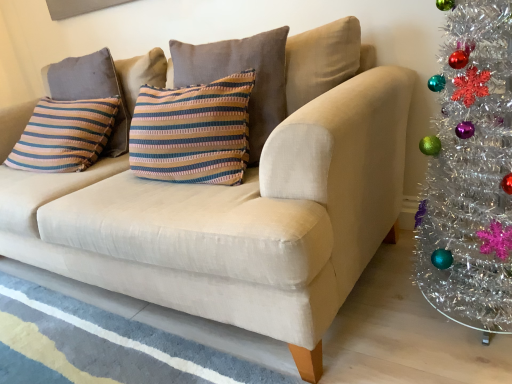
Describe the element at coordinates (240, 71) in the screenshot. The height and width of the screenshot is (384, 512). I see `striped fabric pillow at center, the first pillow from the front` at that location.

Where is `striped fabric pillow at center, the first pillow from the front`? The width and height of the screenshot is (512, 384). striped fabric pillow at center, the first pillow from the front is located at coordinates (240, 71).

Locate an element on the screen. striped fabric pillow at upper left, marked as the 1th pillow in a left-to-right arrangement is located at coordinates (91, 90).

What is the approximate height of striped fabric pillow at upper left, the second pillow positioned from the front?

striped fabric pillow at upper left, the second pillow positioned from the front, is 17.10 inches tall.

Image resolution: width=512 pixels, height=384 pixels. Describe the element at coordinates (91, 90) in the screenshot. I see `striped fabric pillow at upper left, the 2th pillow positioned from the right` at that location.

The width and height of the screenshot is (512, 384). Find the location of `striped fabric pillow at center, the 2th pillow in the left-to-right sequence`. striped fabric pillow at center, the 2th pillow in the left-to-right sequence is located at coordinates (240, 71).

Considering the relative positions of striped fabric pillow at upper left, marked as the 1th pillow in a left-to-right arrangement, and striped fabric pillow at center, the first pillow from the front, in the image provided, is striped fabric pillow at upper left, marked as the 1th pillow in a left-to-right arrangement, to the left or to the right of striped fabric pillow at center, the first pillow from the front,?

From the image, it's evident that striped fabric pillow at upper left, marked as the 1th pillow in a left-to-right arrangement, is to the left of striped fabric pillow at center, the first pillow from the front.

Considering the positions of objects striped fabric pillow at upper left, the 1th pillow viewed from the back, and striped fabric pillow at center, the 2th pillow viewed from the back, in the image provided, who is behind, striped fabric pillow at upper left, the 1th pillow viewed from the back, or striped fabric pillow at center, the 2th pillow viewed from the back,?

striped fabric pillow at upper left, the 1th pillow viewed from the back, is more distant.

Considering the points (108, 57) and (264, 92), which point is in front, point (108, 57) or point (264, 92)?

The point (264, 92) is more forward.

From the image's perspective, between striped fabric pillow at upper left, the 2th pillow positioned from the right, and striped fabric pillow at center, the 2th pillow in the left-to-right sequence, which one is located above?

striped fabric pillow at upper left, the 2th pillow positioned from the right, is shown above in the image.

From a real-world perspective, is striped fabric pillow at upper left, marked as the 1th pillow in a left-to-right arrangement, positioned over striped fabric pillow at center, which appears as the first pillow when viewed from the right, based on gravity?

Incorrect, from a real-world perspective, striped fabric pillow at upper left, marked as the 1th pillow in a left-to-right arrangement, is lower than striped fabric pillow at center, which appears as the first pillow when viewed from the right.

Can you confirm if striped fabric pillow at upper left, marked as the 1th pillow in a left-to-right arrangement, is wider than striped fabric pillow at center, which appears as the first pillow when viewed from the right?

No, striped fabric pillow at upper left, marked as the 1th pillow in a left-to-right arrangement, is not wider than striped fabric pillow at center, which appears as the first pillow when viewed from the right.

Can you confirm if striped fabric pillow at upper left, the 2th pillow positioned from the right, is shorter than striped fabric pillow at center, the first pillow from the front?

Correct, striped fabric pillow at upper left, the 2th pillow positioned from the right, is not as tall as striped fabric pillow at center, the first pillow from the front.

Considering the sizes of objects striped fabric pillow at upper left, the 2th pillow positioned from the right, and striped fabric pillow at center, the 2th pillow viewed from the back, in the image provided, who is bigger, striped fabric pillow at upper left, the 2th pillow positioned from the right, or striped fabric pillow at center, the 2th pillow viewed from the back,?

Bigger between the two is striped fabric pillow at center, the 2th pillow viewed from the back.

Is striped fabric pillow at upper left, marked as the 1th pillow in a left-to-right arrangement, located outside striped fabric pillow at center, the first pillow from the front?

striped fabric pillow at upper left, marked as the 1th pillow in a left-to-right arrangement, lies outside striped fabric pillow at center, the first pillow from the front,'s area.

Is striped fabric pillow at upper left, marked as the 1th pillow in a left-to-right arrangement, next to striped fabric pillow at center, the 2th pillow viewed from the back?

They are not placed beside each other.

Is striped fabric pillow at upper left, the second pillow positioned from the front, positioned with its back to striped fabric pillow at center, the 2th pillow in the left-to-right sequence?

No, striped fabric pillow at center, the 2th pillow in the left-to-right sequence, is not at the back of striped fabric pillow at upper left, the second pillow positioned from the front.

Can you tell me how much striped fabric pillow at upper left, the 2th pillow positioned from the right, and striped fabric pillow at center, the first pillow from the front, differ in facing direction?

striped fabric pillow at upper left, the 2th pillow positioned from the right, and striped fabric pillow at center, the first pillow from the front, are facing 0.00189 degrees away from each other.

I want to click on pillow positioned vertically above the striped fabric pillow at upper left, the 2th pillow positioned from the right (from a real-world perspective), so click(x=240, y=71).

From the picture: Considering the positions of objects striped fabric pillow at center, the 2th pillow viewed from the back, and striped fabric pillow at upper left, marked as the 1th pillow in a left-to-right arrangement, in the image provided, who is more to the right, striped fabric pillow at center, the 2th pillow viewed from the back, or striped fabric pillow at upper left, marked as the 1th pillow in a left-to-right arrangement,?

From the viewer's perspective, striped fabric pillow at center, the 2th pillow viewed from the back, appears more on the right side.

Is striped fabric pillow at center, the first pillow from the front, closer to the viewer compared to striped fabric pillow at upper left, the 1th pillow viewed from the back?

Yes, striped fabric pillow at center, the first pillow from the front, is in front of striped fabric pillow at upper left, the 1th pillow viewed from the back.

Considering the points (216, 76) and (125, 150), which point is behind, point (216, 76) or point (125, 150)?

Positioned behind is point (125, 150).

From the image's perspective, which object appears higher, striped fabric pillow at center, the 2th pillow in the left-to-right sequence, or striped fabric pillow at upper left, marked as the 1th pillow in a left-to-right arrangement?

striped fabric pillow at upper left, marked as the 1th pillow in a left-to-right arrangement.

From a real-world perspective, which is physically above, striped fabric pillow at center, the 2th pillow in the left-to-right sequence, or striped fabric pillow at upper left, the 2th pillow positioned from the right?

striped fabric pillow at center, the 2th pillow in the left-to-right sequence, from a real-world perspective.

Looking at their sizes, would you say striped fabric pillow at center, which appears as the first pillow when viewed from the right, is wider or thinner than striped fabric pillow at upper left, the second pillow positioned from the front?

In the image, striped fabric pillow at center, which appears as the first pillow when viewed from the right, appears to be wider than striped fabric pillow at upper left, the second pillow positioned from the front.

In terms of height, does striped fabric pillow at center, the 2th pillow in the left-to-right sequence, look taller or shorter compared to striped fabric pillow at upper left, the second pillow positioned from the front?

Considering their sizes, striped fabric pillow at center, the 2th pillow in the left-to-right sequence, has more height than striped fabric pillow at upper left, the second pillow positioned from the front.

From the picture: Does striped fabric pillow at center, the 2th pillow in the left-to-right sequence, have a smaller size compared to striped fabric pillow at upper left, the 2th pillow positioned from the right?

Incorrect, striped fabric pillow at center, the 2th pillow in the left-to-right sequence, is not smaller in size than striped fabric pillow at upper left, the 2th pillow positioned from the right.

Is striped fabric pillow at center, the 2th pillow in the left-to-right sequence, spatially inside striped fabric pillow at upper left, the 1th pillow viewed from the back, or outside of it?

striped fabric pillow at center, the 2th pillow in the left-to-right sequence, is spatially situated outside striped fabric pillow at upper left, the 1th pillow viewed from the back.

Is striped fabric pillow at center, the 2th pillow viewed from the back, with striped fabric pillow at upper left, the 2th pillow positioned from the right?

No, striped fabric pillow at center, the 2th pillow viewed from the back, is not next to striped fabric pillow at upper left, the 2th pillow positioned from the right.

Is striped fabric pillow at upper left, the second pillow positioned from the front, at the back of striped fabric pillow at center, the 2th pillow in the left-to-right sequence?

No, striped fabric pillow at upper left, the second pillow positioned from the front, is not at the back of striped fabric pillow at center, the 2th pillow in the left-to-right sequence.

In the scene shown: What's the angular difference between striped fabric pillow at center, the 2th pillow in the left-to-right sequence, and striped fabric pillow at upper left, marked as the 1th pillow in a left-to-right arrangement,'s facing directions?

striped fabric pillow at center, the 2th pillow in the left-to-right sequence, and striped fabric pillow at upper left, marked as the 1th pillow in a left-to-right arrangement, are facing 0.00189 degrees away from each other.

Identify the location of pillow behind the striped fabric pillow at center, the 2th pillow viewed from the back. This screenshot has height=384, width=512. (91, 90).

Find the location of a particular element. pillow to the right of striped fabric pillow at upper left, marked as the 1th pillow in a left-to-right arrangement is located at coordinates (240, 71).

You are a GUI agent. You are given a task and a screenshot of the screen. Output one action in this format:
    pyautogui.click(x=<x>, y=<y>)
    Task: Click on the pillow that is under the striped fabric pillow at center, the 2th pillow in the left-to-right sequence (from a real-world perspective)
    
    Given the screenshot: What is the action you would take?
    pyautogui.click(x=91, y=90)